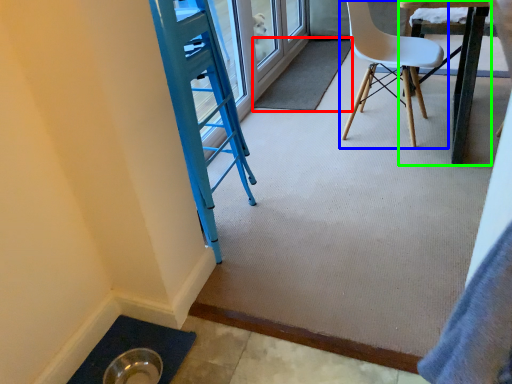
Question: Which is nearer to the mat (highlighted by a red box)? chair (highlighted by a blue box) or table (highlighted by a green box).

Choices:
 (A) chair
 (B) table

Answer: (A)